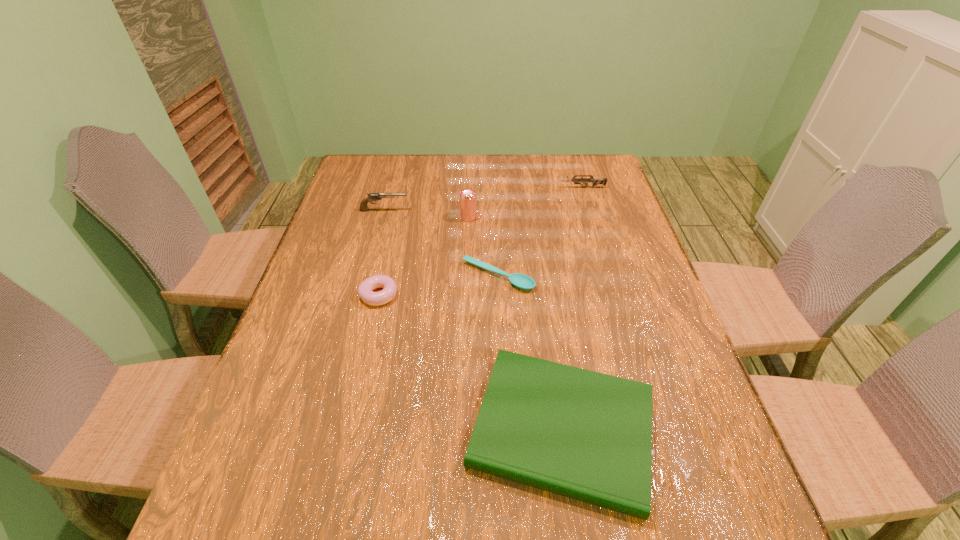
I want to click on empty space between the nearest object and the second tallest object, so click(473, 320).

The width and height of the screenshot is (960, 540). I want to click on free point between the doughnut and the shorter gun, so click(481, 241).

This screenshot has height=540, width=960. What are the coordinates of `free space between the third tallest object and the doughnut` in the screenshot? It's located at (481, 241).

At what (x,y) coordinates should I click in order to perform the action: click on free space that is in between the third farthest object and the shortest object. Please return your answer as a coordinate pair (x, y). This screenshot has width=960, height=540. Looking at the image, I should click on (483, 247).

The height and width of the screenshot is (540, 960). Find the location of `free space between the doughnut and the nearest object`. free space between the doughnut and the nearest object is located at coordinates (470, 362).

Find the location of a particular element. free point between the shortest object and the beer can is located at coordinates (483, 247).

Where is `vacant area that lies between the farther gun and the fifth nearest object`? Image resolution: width=960 pixels, height=540 pixels. vacant area that lies between the farther gun and the fifth nearest object is located at coordinates (483, 199).

Where is `vacant area that lies between the taller gun and the shortest object`? Image resolution: width=960 pixels, height=540 pixels. vacant area that lies between the taller gun and the shortest object is located at coordinates (441, 243).

Locate an element on the screen. The image size is (960, 540). unoccupied position between the doughnut and the farthest object is located at coordinates (481, 241).

Locate an element on the screen. This screenshot has height=540, width=960. blank region between the shortest object and the paperback book is located at coordinates (530, 353).